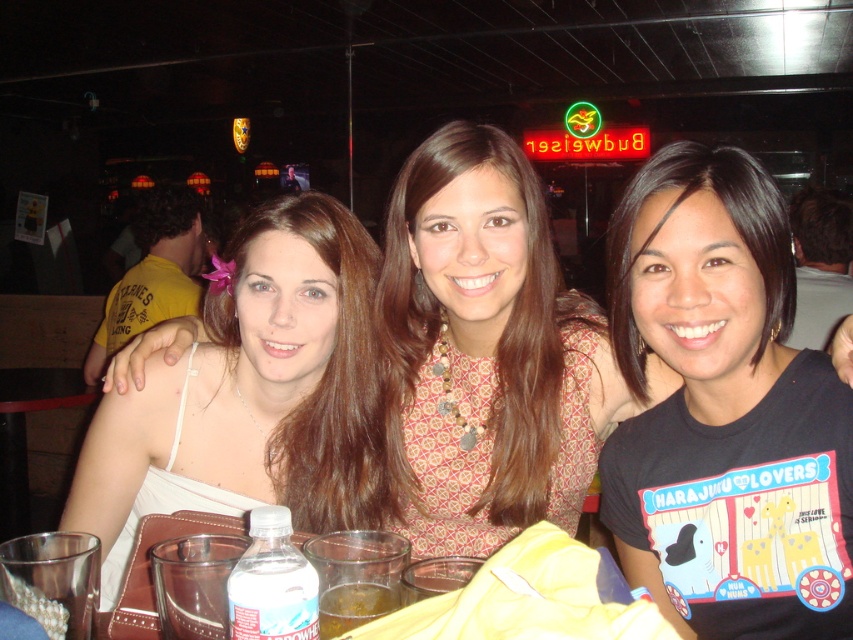
Question: Does brown hair at left have a greater width compared to translucent glass cup at center?

Choices:
 (A) no
 (B) yes

Answer: (B)

Question: Does patterned fabric dress at center have a larger size compared to brown hair at left?

Choices:
 (A) yes
 (B) no

Answer: (A)

Question: Which is nearer to the brown leather table at lower left?

Choices:
 (A) white fabric dress at center
 (B) clear plastic bottle at lower center

Answer: (A)

Question: Considering the real-world distances, which object is closest to the clear plastic bottle at lower center?

Choices:
 (A) translucent plastic cup at lower center
 (B) brown hair at center
 (C) brown hair at left
 (D) black matte hair at center

Answer: (A)

Question: Observing the image, what is the correct spatial positioning of white fabric dress at center in reference to brown hair at left?

Choices:
 (A) above
 (B) below

Answer: (B)

Question: Which object is closer to the camera taking this photo?

Choices:
 (A) black matte hair at center
 (B) brown hair at left
 (C) brown leather table at lower left
 (D) clear plastic bottle at lower center

Answer: (D)